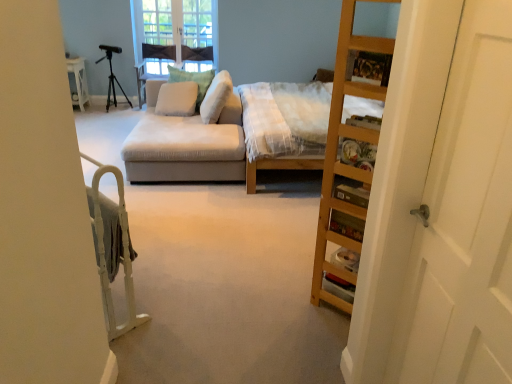
Question: Is black matte tripod at upper left a part of suede-like beige couch at center?

Choices:
 (A) no
 (B) yes

Answer: (A)

Question: Is suede-like beige couch at center closer to the viewer compared to black matte tripod at upper left?

Choices:
 (A) no
 (B) yes

Answer: (B)

Question: Is suede-like beige couch at center located outside black matte tripod at upper left?

Choices:
 (A) no
 (B) yes

Answer: (B)

Question: From a real-world perspective, is suede-like beige couch at center on black matte tripod at upper left?

Choices:
 (A) no
 (B) yes

Answer: (A)

Question: Is suede-like beige couch at center positioned with its back to black matte tripod at upper left?

Choices:
 (A) no
 (B) yes

Answer: (A)

Question: Considering the relative sizes of suede-like beige couch at center and black matte tripod at upper left in the image provided, is suede-like beige couch at center thinner than black matte tripod at upper left?

Choices:
 (A) yes
 (B) no

Answer: (B)

Question: Is white wood bed frame at left at the back of white wooden door at right?

Choices:
 (A) no
 (B) yes

Answer: (A)

Question: Does white wooden door at right appear on the right side of white wood bed frame at left?

Choices:
 (A) no
 (B) yes

Answer: (B)

Question: Considering the relative sizes of white wooden door at right and white wood bed frame at left in the image provided, is white wooden door at right bigger than white wood bed frame at left?

Choices:
 (A) no
 (B) yes

Answer: (B)

Question: Is white wooden door at right behind white wood bed frame at left?

Choices:
 (A) no
 (B) yes

Answer: (A)

Question: Considering the relative sizes of white wooden door at right and white wood bed frame at left in the image provided, is white wooden door at right wider than white wood bed frame at left?

Choices:
 (A) yes
 (B) no

Answer: (B)

Question: Is the position of white wooden door at right less distant than that of white wood bed frame at left?

Choices:
 (A) no
 (B) yes

Answer: (B)

Question: Considering the relative positions of white wooden door at right and suede-like beige couch at center in the image provided, is white wooden door at right behind suede-like beige couch at center?

Choices:
 (A) no
 (B) yes

Answer: (A)